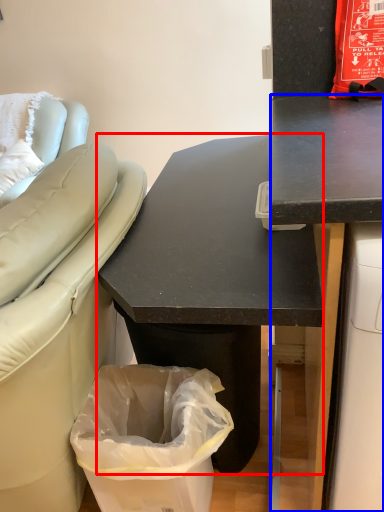
Question: Which point is further to the camera, desk (highlighted by a red box) or desk (highlighted by a blue box)?

Choices:
 (A) desk
 (B) desk

Answer: (A)